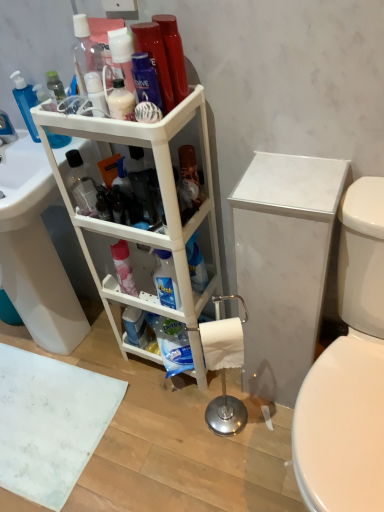
Find the location of a particular element. Image resolution: width=384 pixels, height=512 pixels. vacant space situated above white marble cabinet at right (from a real-world perspective) is located at coordinates (289, 177).